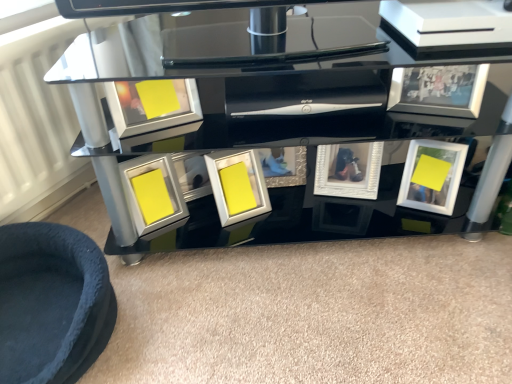
Locate an element on the screen. This screenshot has height=384, width=512. free space between black glass table at center and velvet blue pet bed at lower left is located at coordinates (260, 303).